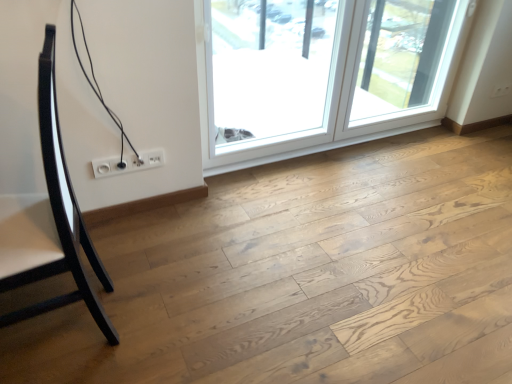
Identify the location of free space to the back side of glossy black chair at left. This screenshot has height=384, width=512. coord(132,244).